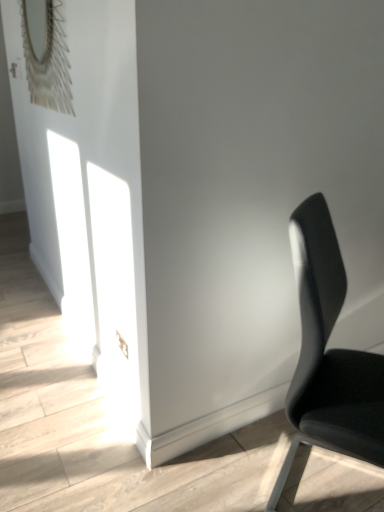
At what (x,y) coordinates should I click in order to perform the action: click on vacant space to the left of black leather chair at right. Please return your answer as a coordinate pair (x, y). Looking at the image, I should click on (215, 467).